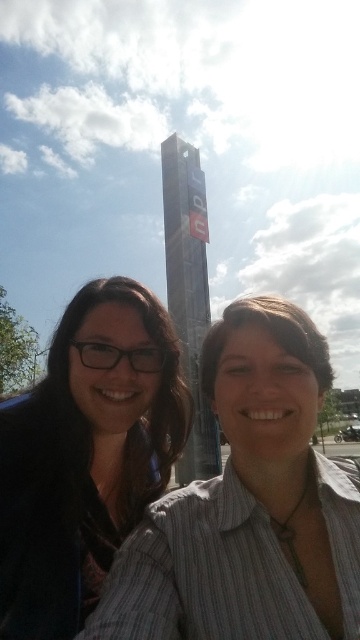
Which is below, matte black glasses at left or metallic glass tower at center?

matte black glasses at left is below.

Does matte black glasses at left have a greater height compared to metallic glass tower at center?

Incorrect, matte black glasses at left's height is not larger of metallic glass tower at center's.

Is point (48, 410) closer to viewer compared to point (217, 435)?

Yes, it is in front of point (217, 435).

Where is `matte black glasses at left`? The image size is (360, 640). matte black glasses at left is located at coordinates (86, 454).

From the picture: Does striped shirt at center have a greater width compared to matte black glasses at left?

No, striped shirt at center is not wider than matte black glasses at left.

What do you see at coordinates (249, 506) in the screenshot? This screenshot has height=640, width=360. I see `striped shirt at center` at bounding box center [249, 506].

This screenshot has height=640, width=360. Find the location of `striped shirt at center`. striped shirt at center is located at coordinates (249, 506).

This screenshot has height=640, width=360. Describe the element at coordinates (249, 506) in the screenshot. I see `striped shirt at center` at that location.

Measure the distance between striped shirt at center and camera.

striped shirt at center and camera are 11.98 meters apart from each other.

From the picture: Who is more forward, [253,483] or [201,209]?

Positioned in front is point [253,483].

This screenshot has width=360, height=640. Identify the location of striped shirt at center. (249, 506).